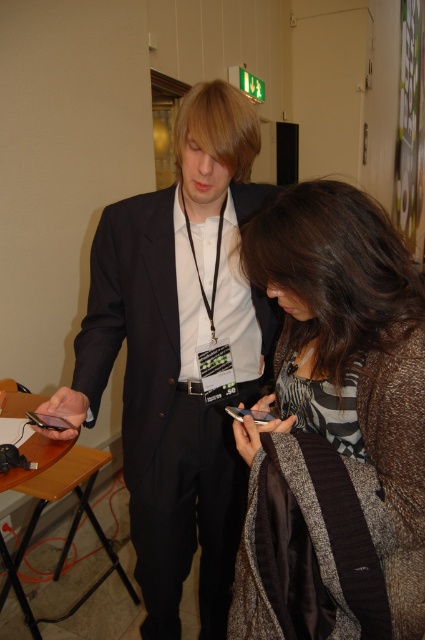
Can you confirm if black matte suit at center is shorter than matte black smartphone at center?

Incorrect, black matte suit at center's height does not fall short of matte black smartphone at center's.

In order to click on black matte suit at center in this screenshot , I will do `click(178, 355)`.

The image size is (425, 640). In order to click on black matte suit at center in this screenshot , I will do [x=178, y=355].

Is striped fabric shirt at center below matte black smartphone at center?

Actually, striped fabric shirt at center is above matte black smartphone at center.

This screenshot has width=425, height=640. Identify the location of striped fabric shirt at center. (334, 428).

Which is behind, point (380, 458) or point (181, 148)?

Point (181, 148)

Between point (291, 280) and point (227, 125), which one is positioned behind?

Positioned behind is point (227, 125).

Find the location of a particular element. Image resolution: width=425 pixels, height=640 pixels. striped fabric shirt at center is located at coordinates (334, 428).